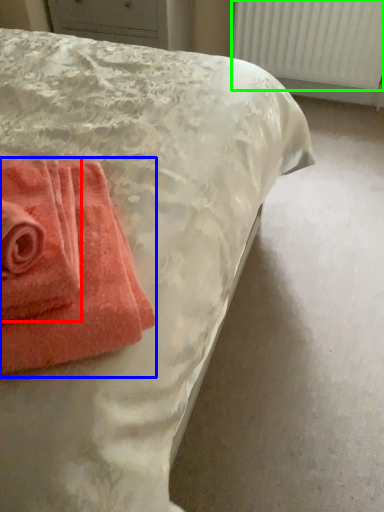
Question: Based on their relative distances, which object is farther from towel (highlighted by a red box)? Choose from towel (highlighted by a blue box) and radiator (highlighted by a green box).

Choices:
 (A) towel
 (B) radiator

Answer: (B)